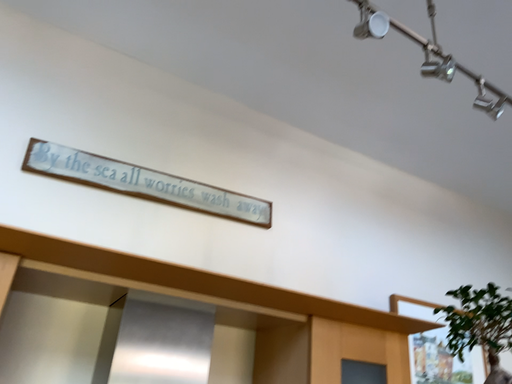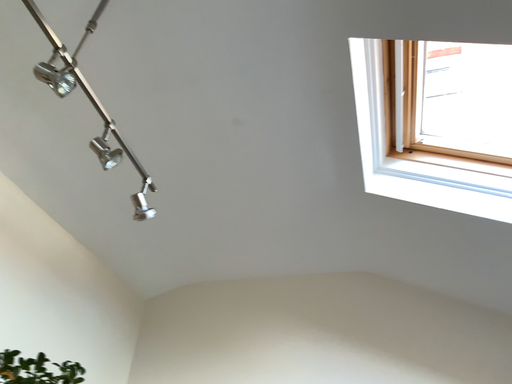
Question: How did the camera likely rotate when shooting the video?

Choices:
 (A) rotated right
 (B) rotated left

Answer: (A)